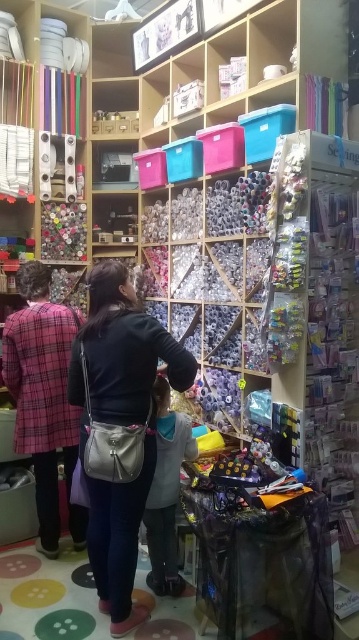
Question: Which of the following is the closest to the observer?

Choices:
 (A) (48, 520)
 (B) (99, 416)

Answer: (B)

Question: Which point is closer to the camera taking this photo?

Choices:
 (A) (34, 364)
 (B) (115, 307)

Answer: (B)

Question: From the image, what is the correct spatial relationship of matte black purse at center in relation to plaid fabric coat at left?

Choices:
 (A) right
 (B) left

Answer: (A)

Question: Is matte black purse at center positioned at the back of plaid fabric coat at left?

Choices:
 (A) no
 (B) yes

Answer: (A)

Question: Is matte black purse at center further to camera compared to plaid fabric coat at left?

Choices:
 (A) no
 (B) yes

Answer: (A)

Question: Which object is farther from the camera taking this photo?

Choices:
 (A) plaid fabric coat at left
 (B) matte black purse at center

Answer: (A)